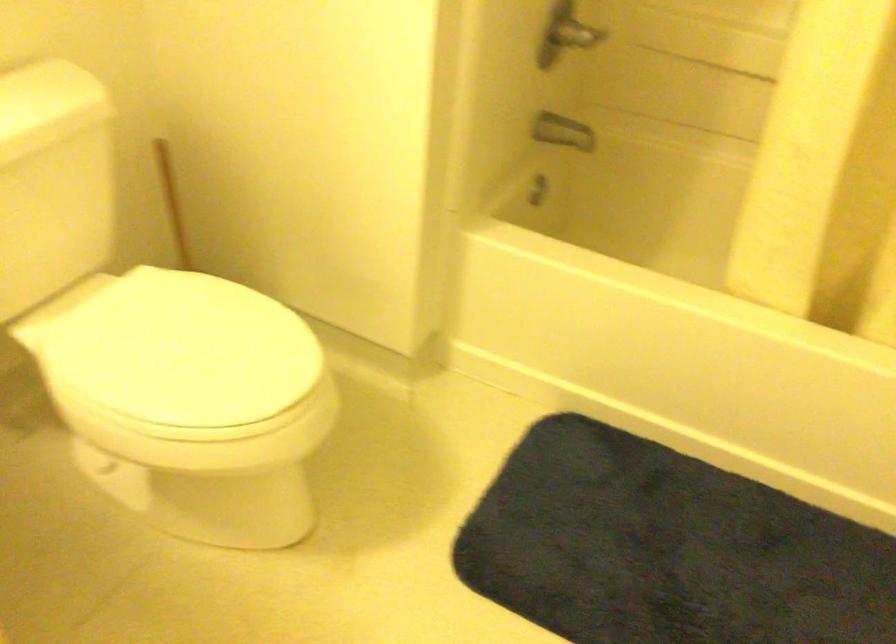
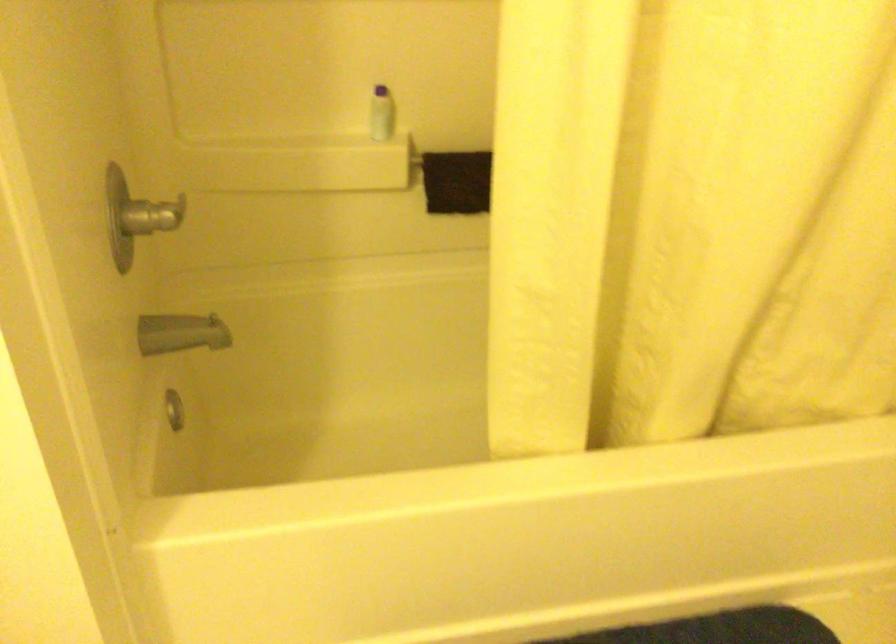
Question: The camera is either moving clockwise (left) or counter-clockwise (right) around the object. The first image is from the beginning of the video and the second image is from the end. Is the camera moving left or right when shooting the video?

Choices:
 (A) Left
 (B) Right

Answer: (A)